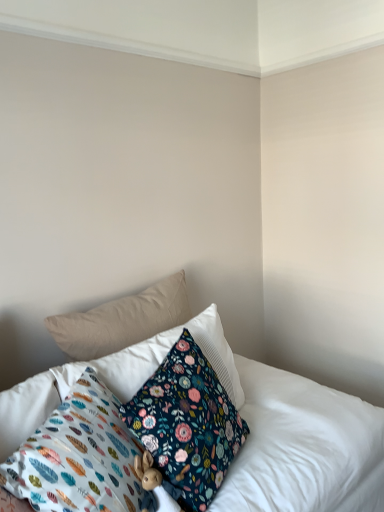
Looking at this image, how much space does floral fabric pillow at center, acting as the 3th pillow starting from the back, occupy horizontally?

8.42 inches.

Identify the location of floral fabric pillow at center, marked as the 2th pillow in a back-to-front arrangement. (159, 360).

Identify the location of floral fabric pillow at center, acting as the 3th pillow starting from the back. (186, 425).

Which is behind, point (59, 376) or point (91, 460)?

Point (59, 376)

From the floral fabric pillow at lower center, which is the 1th pillow from front to back, count 2nd pillows backward and point to it. Please provide its 2D coordinates.

[(159, 360)]

Considering the positions of objects floral fabric pillow at center, acting as the 3th pillow starting from the front, and floral fabric pillow at lower center, which is the 4th pillow in back-to-front order, in the image provided, who is in front, floral fabric pillow at center, acting as the 3th pillow starting from the front, or floral fabric pillow at lower center, which is the 4th pillow in back-to-front order,?

floral fabric pillow at lower center, which is the 4th pillow in back-to-front order, is more forward.

Does floral fabric pillow at center, acting as the 3th pillow starting from the front, have a greater width compared to floral fabric pillow at lower center, which is the 1th pillow from front to back?

In fact, floral fabric pillow at center, acting as the 3th pillow starting from the front, might be narrower than floral fabric pillow at lower center, which is the 1th pillow from front to back.

Considering the relative sizes of floral fabric pillow at center, acting as the 3th pillow starting from the front, and beige fabric pillow at upper left, positioned as the 4th pillow in front-to-back order, in the image provided, is floral fabric pillow at center, acting as the 3th pillow starting from the front, smaller than beige fabric pillow at upper left, positioned as the 4th pillow in front-to-back order,?

Incorrect, floral fabric pillow at center, acting as the 3th pillow starting from the front, is not smaller in size than beige fabric pillow at upper left, positioned as the 4th pillow in front-to-back order.

From a real-world perspective, is floral fabric pillow at center, marked as the 2th pillow in a back-to-front arrangement, positioned under beige fabric pillow at upper left, the first pillow when ordered from back to front, based on gravity?

Yes, from a real-world perspective, floral fabric pillow at center, marked as the 2th pillow in a back-to-front arrangement, is under beige fabric pillow at upper left, the first pillow when ordered from back to front.

From a real-world perspective, starting from the beige fabric pillow at upper left, the first pillow when ordered from back to front, which pillow is the 1st one below it? Please provide its 2D coordinates.

[(159, 360)]

Looking at this image, can you confirm if floral fabric pillow at center, marked as the 2th pillow in a back-to-front arrangement, is positioned to the left of beige fabric pillow at upper left, positioned as the 4th pillow in front-to-back order?

→ No.

Between beige fabric pillow at upper left, the first pillow when ordered from back to front, and floral fabric pillow at center, arranged as the second pillow when viewed from the front, which one appears on the left side from the viewer's perspective?

From the viewer's perspective, beige fabric pillow at upper left, the first pillow when ordered from back to front, appears more on the left side.

From the image's perspective, between beige fabric pillow at upper left, positioned as the 4th pillow in front-to-back order, and floral fabric pillow at center, acting as the 3th pillow starting from the back, which one is located above?

beige fabric pillow at upper left, positioned as the 4th pillow in front-to-back order, is shown above in the image.

From a real-world perspective, is beige fabric pillow at upper left, the first pillow when ordered from back to front, above or below floral fabric pillow at center, acting as the 3th pillow starting from the back?

beige fabric pillow at upper left, the first pillow when ordered from back to front, is above floral fabric pillow at center, acting as the 3th pillow starting from the back.

Is beige fabric pillow at upper left, positioned as the 4th pillow in front-to-back order, looking in the opposite direction of floral fabric pillow at center, acting as the 3th pillow starting from the back?

No, beige fabric pillow at upper left, positioned as the 4th pillow in front-to-back order, is not facing the opposite direction of floral fabric pillow at center, acting as the 3th pillow starting from the back.

Between floral fabric pillow at lower center, which is the 4th pillow in back-to-front order, and floral fabric pillow at center, arranged as the second pillow when viewed from the front, which one appears on the right side from the viewer's perspective?

From the viewer's perspective, floral fabric pillow at center, arranged as the second pillow when viewed from the front, appears more on the right side.

Is floral fabric pillow at lower center, which is the 1th pillow from front to back, looking in the opposite direction of floral fabric pillow at center, acting as the 3th pillow starting from the back?

No, floral fabric pillow at lower center, which is the 1th pillow from front to back, is not facing away from floral fabric pillow at center, acting as the 3th pillow starting from the back.

Considering the sizes of objects floral fabric pillow at lower center, which is the 4th pillow in back-to-front order, and floral fabric pillow at center, acting as the 3th pillow starting from the back, in the image provided, who is wider, floral fabric pillow at lower center, which is the 4th pillow in back-to-front order, or floral fabric pillow at center, acting as the 3th pillow starting from the back,?

With larger width is floral fabric pillow at lower center, which is the 4th pillow in back-to-front order.

Which is in front, point (107, 410) or point (168, 383)?

The point (107, 410) is in front.

Considering the positions of point (143, 310) and point (136, 380), is point (143, 310) closer or farther from the camera than point (136, 380)?

Point (143, 310).

Which of these two, beige fabric pillow at upper left, the first pillow when ordered from back to front, or floral fabric pillow at center, marked as the 2th pillow in a back-to-front arrangement, stands shorter?

Standing shorter between the two is beige fabric pillow at upper left, the first pillow when ordered from back to front.

Is beige fabric pillow at upper left, positioned as the 4th pillow in front-to-back order, facing away from floral fabric pillow at center, marked as the 2th pillow in a back-to-front arrangement?

beige fabric pillow at upper left, positioned as the 4th pillow in front-to-back order, is not turned away from floral fabric pillow at center, marked as the 2th pillow in a back-to-front arrangement.

Does beige fabric pillow at upper left, positioned as the 4th pillow in front-to-back order, have a lesser width compared to floral fabric pillow at center, acting as the 3th pillow starting from the front?

Indeed, beige fabric pillow at upper left, positioned as the 4th pillow in front-to-back order, has a lesser width compared to floral fabric pillow at center, acting as the 3th pillow starting from the front.

Relative to floral fabric pillow at center, marked as the 2th pillow in a back-to-front arrangement, is floral fabric pillow at lower center, which is the 4th pillow in back-to-front order, in front or behind?

Clearly, floral fabric pillow at lower center, which is the 4th pillow in back-to-front order, is in front of floral fabric pillow at center, marked as the 2th pillow in a back-to-front arrangement.

From the image's perspective, does floral fabric pillow at lower center, which is the 1th pillow from front to back, appear higher than floral fabric pillow at center, marked as the 2th pillow in a back-to-front arrangement?

Incorrect, from the image's perspective, floral fabric pillow at lower center, which is the 1th pillow from front to back, is lower than floral fabric pillow at center, marked as the 2th pillow in a back-to-front arrangement.

Does floral fabric pillow at lower center, which is the 1th pillow from front to back, have a larger size compared to floral fabric pillow at center, marked as the 2th pillow in a back-to-front arrangement?

No.

Which is behind, point (87, 378) or point (153, 364)?

The point (153, 364) is behind.

Consider the image. How far apart are floral fabric pillow at center, arranged as the second pillow when viewed from the front, and floral fabric pillow at lower center, which is the 1th pillow from front to back?

floral fabric pillow at center, arranged as the second pillow when viewed from the front, is 5.95 inches from floral fabric pillow at lower center, which is the 1th pillow from front to back.

Is floral fabric pillow at center, acting as the 3th pillow starting from the back, taller or shorter than floral fabric pillow at lower center, which is the 1th pillow from front to back?

floral fabric pillow at center, acting as the 3th pillow starting from the back, is shorter than floral fabric pillow at lower center, which is the 1th pillow from front to back.

Do you think floral fabric pillow at center, acting as the 3th pillow starting from the back, is within floral fabric pillow at lower center, which is the 1th pillow from front to back, or outside of it?

floral fabric pillow at center, acting as the 3th pillow starting from the back, is located beyond the bounds of floral fabric pillow at lower center, which is the 1th pillow from front to back.

Locate an element on the screen. Image resolution: width=384 pixels, height=512 pixels. the 1st pillow behind the floral fabric pillow at lower center, which is the 1th pillow from front to back is located at coordinates (186, 425).

Identify the location of pillow that is the 2nd one when counting backward from the floral fabric pillow at lower center, which is the 4th pillow in back-to-front order. The width and height of the screenshot is (384, 512). (159, 360).

The height and width of the screenshot is (512, 384). In order to click on pillow that is the 1st object directly below the beige fabric pillow at upper left, positioned as the 4th pillow in front-to-back order (from a real-world perspective) in this screenshot , I will do `click(159, 360)`.

From the image, which object appears to be nearer to floral fabric pillow at lower center, which is the 1th pillow from front to back, beige fabric pillow at upper left, the first pillow when ordered from back to front, or floral fabric pillow at center, acting as the 3th pillow starting from the back?

floral fabric pillow at center, acting as the 3th pillow starting from the back, is positioned closer to the anchor floral fabric pillow at lower center, which is the 1th pillow from front to back.

Based on their spatial positions, is beige fabric pillow at upper left, the first pillow when ordered from back to front, or floral fabric pillow at center, arranged as the second pillow when viewed from the front, closer to floral fabric pillow at center, marked as the 2th pillow in a back-to-front arrangement?

Among the two, floral fabric pillow at center, arranged as the second pillow when viewed from the front, is located nearer to floral fabric pillow at center, marked as the 2th pillow in a back-to-front arrangement.

From the image, which object appears to be nearer to floral fabric pillow at lower center, which is the 4th pillow in back-to-front order, floral fabric pillow at center, marked as the 2th pillow in a back-to-front arrangement, or floral fabric pillow at center, arranged as the second pillow when viewed from the front?

floral fabric pillow at center, arranged as the second pillow when viewed from the front, is closer to floral fabric pillow at lower center, which is the 4th pillow in back-to-front order.

Which object lies further to the anchor point beige fabric pillow at upper left, the first pillow when ordered from back to front, floral fabric pillow at center, arranged as the second pillow when viewed from the front, or floral fabric pillow at center, acting as the 3th pillow starting from the front?

floral fabric pillow at center, arranged as the second pillow when viewed from the front.

Estimate the real-world distances between objects in this image. Which object is closer to beige fabric pillow at upper left, positioned as the 4th pillow in front-to-back order, floral fabric pillow at center, acting as the 3th pillow starting from the back, or floral fabric pillow at lower center, which is the 4th pillow in back-to-front order?

floral fabric pillow at center, acting as the 3th pillow starting from the back, is closer to beige fabric pillow at upper left, positioned as the 4th pillow in front-to-back order.

From the image, which object appears to be nearer to floral fabric pillow at center, acting as the 3th pillow starting from the back, beige fabric pillow at upper left, the first pillow when ordered from back to front, or floral fabric pillow at lower center, which is the 1th pillow from front to back?

The object closer to floral fabric pillow at center, acting as the 3th pillow starting from the back, is floral fabric pillow at lower center, which is the 1th pillow from front to back.

Considering their positions, is floral fabric pillow at center, acting as the 3th pillow starting from the front, positioned further to floral fabric pillow at center, arranged as the second pillow when viewed from the front, than floral fabric pillow at lower center, which is the 4th pillow in back-to-front order?

floral fabric pillow at center, acting as the 3th pillow starting from the front.

From the image, which object appears to be nearer to floral fabric pillow at center, arranged as the second pillow when viewed from the front, floral fabric pillow at lower center, which is the 4th pillow in back-to-front order, or floral fabric pillow at center, acting as the 3th pillow starting from the front?

floral fabric pillow at lower center, which is the 4th pillow in back-to-front order, is positioned closer to the anchor floral fabric pillow at center, arranged as the second pillow when viewed from the front.

The height and width of the screenshot is (512, 384). In order to click on pillow located between floral fabric pillow at lower center, which is the 1th pillow from front to back, and floral fabric pillow at center, marked as the 2th pillow in a back-to-front arrangement, in the depth direction in this screenshot , I will do `click(186, 425)`.

The height and width of the screenshot is (512, 384). What are the coordinates of `pillow between floral fabric pillow at center, acting as the 3th pillow starting from the back, and beige fabric pillow at upper left, positioned as the 4th pillow in front-to-back order, along the z-axis` in the screenshot? It's located at (159, 360).